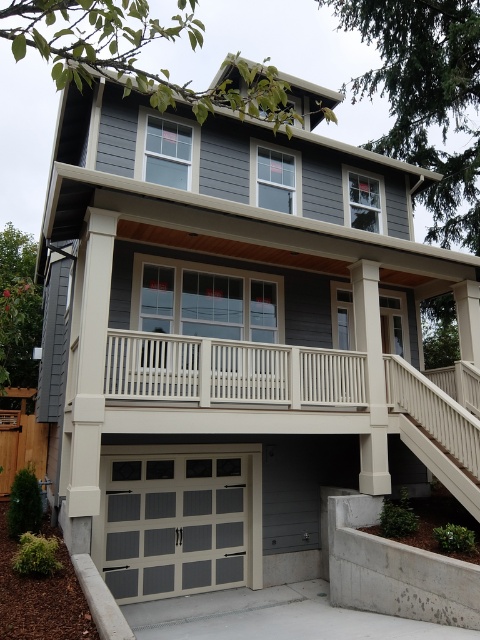
You are a delivery person trying to unload a large package from your truck parked on the gray concrete driveway at lower center. You need to move the package to the white textured stairs at lower right. Based on the scene, can you determine if the package will fit through the space between the driveway and the stairs?

The gray concrete driveway at lower center is much taller than the white textured stairs at lower right, so the package may not fit through the space between them due to the height difference.

You are a delivery person trying to park your van in front of the house. The van is as wide as the white textured stairs at lower right. Can you park the van next to the matte gray panel garage door at lower center without overlapping it?

The matte gray panel garage door at lower center is wider than the white textured stairs at lower right. Since the van is as wide as the stairs, it can park next to the garage door without overlapping as there is enough space.

You are a delivery person with a cart that is 3.5 meters wide. You need to move your cart from the driveway to the front door, which is located behind the covered porch. The path between the matte gray panel garage door at lower center and the white textured stairs at lower right is the only route available. Will your cart fit through this path?

The distance between the matte gray panel garage door at lower center and the white textured stairs at lower right is 3.49 meters. Since the cart is 3.5 meters wide, it is slightly wider than the available space, so the cart will not fit through the path between them.